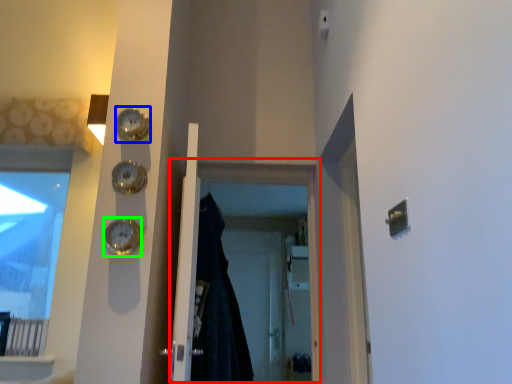
Question: Which is nearer to the screen door (highlighted by a red box)? clock (highlighted by a blue box) or clock (highlighted by a green box).

Choices:
 (A) clock
 (B) clock

Answer: (A)